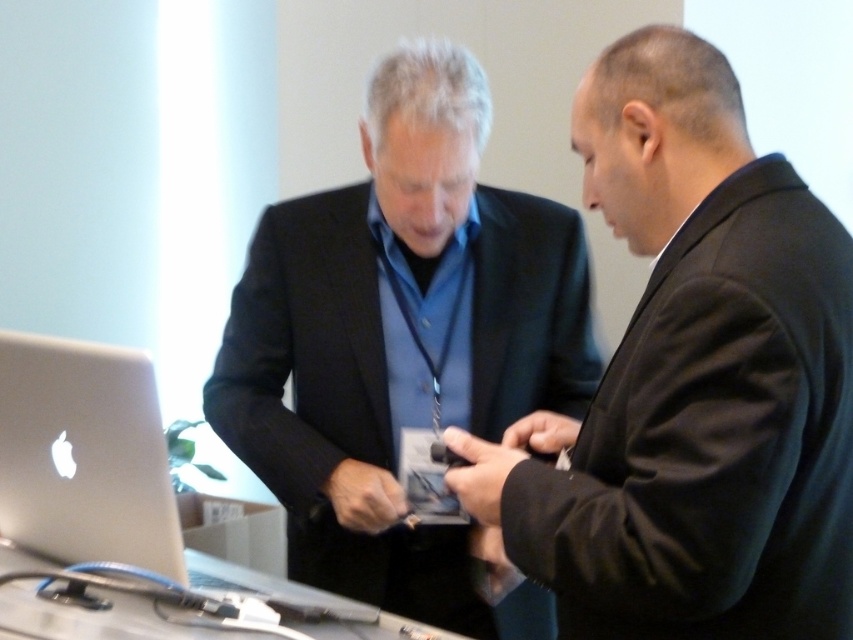
Based on the photo, you are a photographer trying to capture a clear photo of the silver metallic laptop at lower left. However, the black matte suit at center is blocking your view. Can you move the laptop to the side to get a better shot?

The black matte suit at center is positioned over silver metallic laptop at lower left, so moving the laptop to the side might not be possible without adjusting the suit first.

You are a photographer setting up for a group photo. You have a matte black suit at center and a metallic gray table at lower center in your frame. Which object should you adjust to ensure both fit within the camera frame? Explain your reasoning.

The matte black suit at center is larger in size than the metallic gray table at lower center, so you should adjust the position of the matte black suit at center to ensure both fit within the camera frame.

You are trying to place a small object between the matte black suit at center and the metallic gray table at lower center. According to the scene, can you fit it there?

The matte black suit at center is to the right of the metallic gray table at lower center, so there is space between them where the small object can be placed.